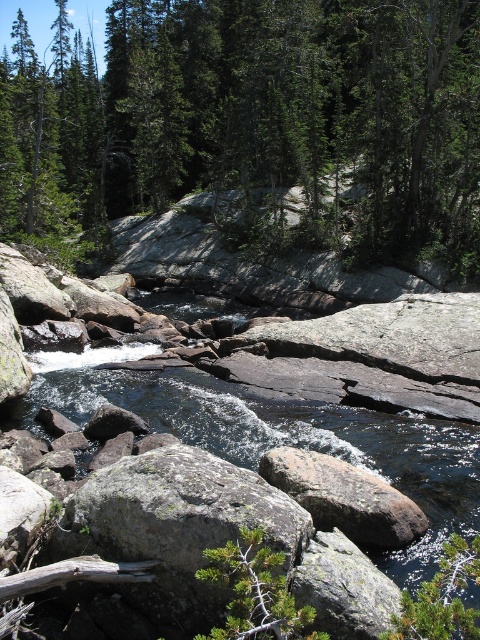
Is point (364, 257) farther from camera compared to point (369, 493)?

Yes.

Between point (466, 28) and point (288, 465), which one is positioned behind?

The point (466, 28) is more distant.

Locate an element on the screen. green leafy tree at center is located at coordinates (253, 125).